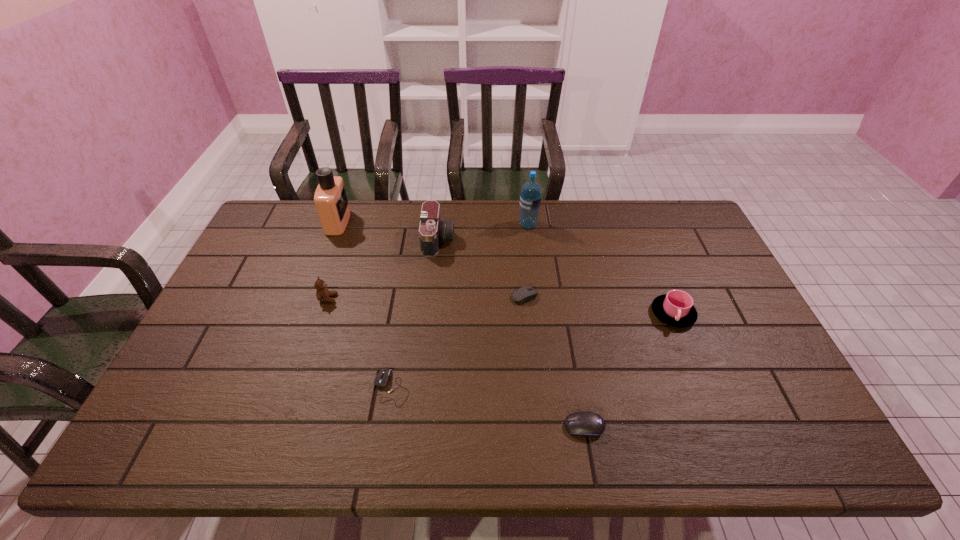
Find the location of a particular element. The image size is (960, 540). the second nearest object is located at coordinates (382, 378).

You are a GUI agent. You are given a task and a screenshot of the screen. Output one action in this format:
    pyautogui.click(x=<x>, y=<y>)
    Task: Click on the free space located 0.400m on the front of the water bottle
    This screenshot has height=540, width=960.
    Given the screenshot: What is the action you would take?
    pyautogui.click(x=540, y=320)

The width and height of the screenshot is (960, 540). What are the coordinates of `vacant space positioned on the front label of the perfume` in the screenshot? It's located at (421, 222).

The image size is (960, 540). What are the coordinates of `free space located on the front-facing side of the camera` in the screenshot? It's located at (484, 240).

Locate an element on the screen. This screenshot has width=960, height=540. free space located 0.280m at the face of the fourth tallest object is located at coordinates (431, 299).

What are the coordinates of `free space located 0.230m on the side with the handle of the rightmost object` in the screenshot? It's located at (710, 407).

Where is `vacant area situated 0.190m on the right of the nearest computer mouse`? Image resolution: width=960 pixels, height=540 pixels. vacant area situated 0.190m on the right of the nearest computer mouse is located at coordinates (686, 427).

Where is `vacant space located on the right of the second computer mouse from left to right`? vacant space located on the right of the second computer mouse from left to right is located at coordinates (585, 296).

What are the coordinates of `vacant space located on the back of the shortest object` in the screenshot? It's located at (399, 343).

Find the location of a particular element. The image size is (960, 540). water bottle at the far edge is located at coordinates (530, 197).